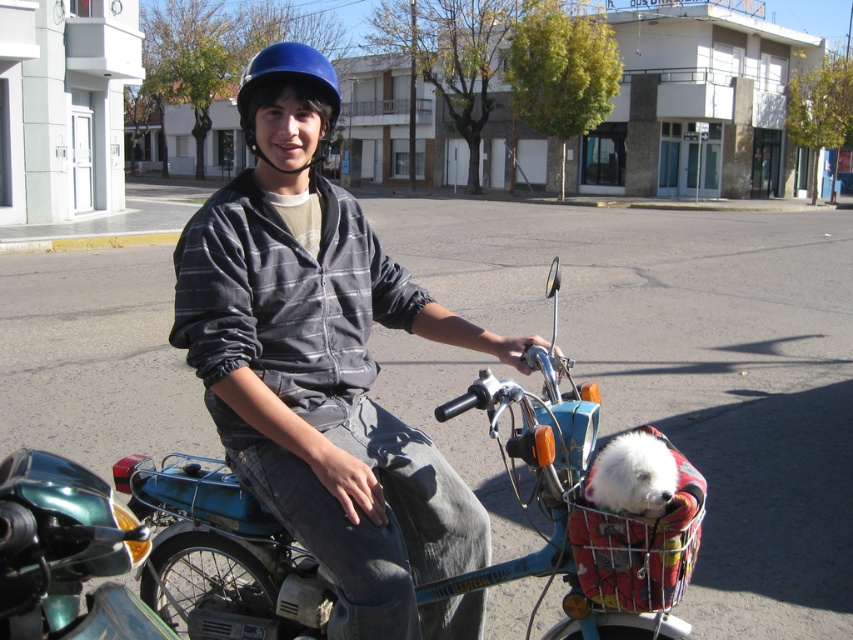
You are a delivery person who needs to pick up a package from a store located at the coordinates mentioned in the image. The motorcycle you see is parked at point 0.802, 0.683. Can you confirm if the blue metallic motorcycle at center is the one parked at those coordinates?

Yes, the blue metallic motorcycle at center is parked at point (x=582, y=513) as stated in the description.

Wait, the objects list has two entries that are almost the same. The first is matte blue helmet at center and the second is blue matte helmet at center. The objects description says the first has greater height than the second. But they are the same object? Or are they different? Maybe a typo? Let me check the rules again. The user might have made a mistake in the object labels. But according to the rules, I must use the object labels exactly as given. So even if they seem duplicates, I have to treat them a

The question cannot be generated because the object labels are duplicates. Please verify the input data for accuracy.

You are a delivery person who needs to ensure that your helmet and motorcycle are visible to traffic. Based on the scene, which object, the matte blue helmet at center or the blue metallic motorcycle at center, is larger in size?

The matte blue helmet at center is bigger than the blue metallic motorcycle at center, so the helmet is larger in size.